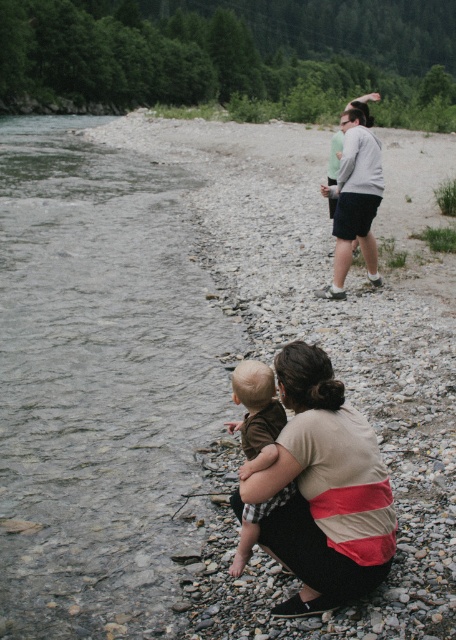
Question: Can you confirm if beige striped shirt at lower center is smaller than brown cotton shirt at lower center?

Choices:
 (A) no
 (B) yes

Answer: (A)

Question: Which of these objects is positioned farthest from the beige striped shirt at lower center?

Choices:
 (A) clear water at stream left
 (B) brown cotton shirt at lower center

Answer: (A)

Question: Which point appears farthest from the camera in this image?

Choices:
 (A) (41, 240)
 (B) (265, 532)

Answer: (A)

Question: Can you confirm if beige striped shirt at lower center is bigger than brown cotton shirt at lower center?

Choices:
 (A) no
 (B) yes

Answer: (B)

Question: Among these objects, which one is nearest to the camera?

Choices:
 (A) clear water at stream left
 (B) brown cotton shirt at lower center

Answer: (B)

Question: Can you confirm if clear water at stream left is wider than beige striped shirt at lower center?

Choices:
 (A) yes
 (B) no

Answer: (A)